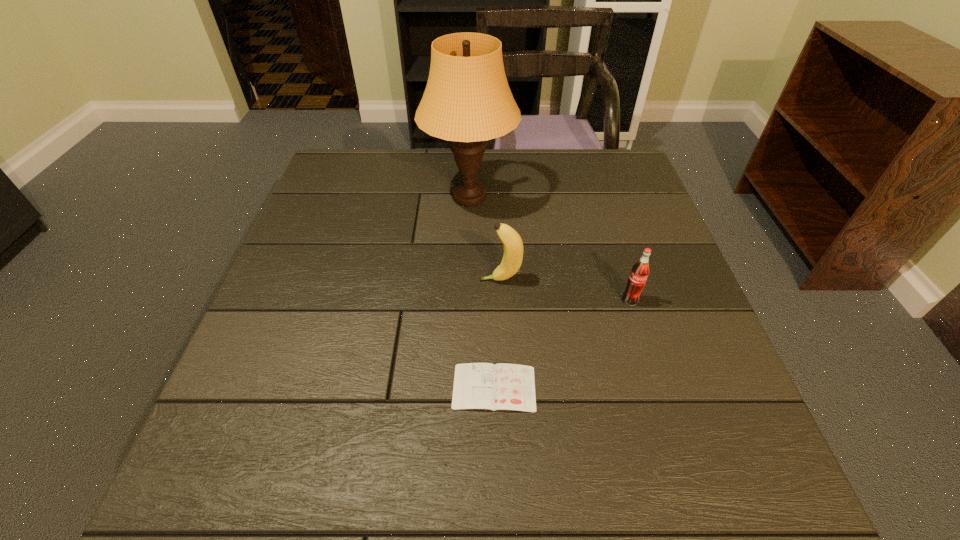
Identify the location of the farthest object. (467, 100).

Locate an element on the screen. The width and height of the screenshot is (960, 540). lampshade is located at coordinates (467, 100).

This screenshot has height=540, width=960. I want to click on banana, so click(x=513, y=246).

At what (x,y) coordinates should I click in order to perform the action: click on the third farthest object. Please return your answer as a coordinate pair (x, y). This screenshot has width=960, height=540. Looking at the image, I should click on (640, 271).

What are the coordinates of `soda bottle` in the screenshot? It's located at (640, 271).

This screenshot has height=540, width=960. What are the coordinates of `the nearest object` in the screenshot? It's located at (502, 386).

Find the location of a particular element. Image resolution: width=960 pixels, height=540 pixels. diary is located at coordinates (502, 386).

You are a GUI agent. You are given a task and a screenshot of the screen. Output one action in this format:
    pyautogui.click(x=<x>, y=<y>)
    Task: Click on the vacant region located on the right of the farthest object
    The height and width of the screenshot is (540, 960).
    Given the screenshot: What is the action you would take?
    pyautogui.click(x=631, y=197)

The width and height of the screenshot is (960, 540). In order to click on blank space located 0.190m from the stem of the third nearest object in this screenshot , I will do (396, 280).

Locate an element on the screen. free space located from the stem of the third nearest object is located at coordinates (321, 280).